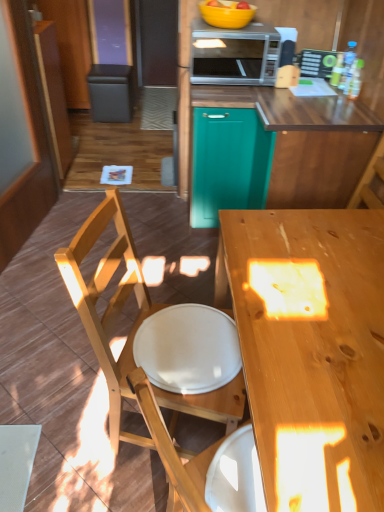
At what (x,y) coordinates should I click in order to perform the action: click on white matte plate at center. Please return your answer as a coordinate pair (x, y). Looking at the image, I should click on (188, 349).

What do you see at coordinates (316, 63) in the screenshot? The width and height of the screenshot is (384, 512). I see `green plastic sign at upper right` at bounding box center [316, 63].

What do you see at coordinates (305, 141) in the screenshot? Image resolution: width=384 pixels, height=512 pixels. I see `wooden countertop at center` at bounding box center [305, 141].

Measure the distance between point [197,90] and camera.

Point [197,90] and camera are 6.80 feet apart from each other.

Where is `wooden chair at left`? This screenshot has height=512, width=384. wooden chair at left is located at coordinates (109, 302).

What is the approximate width of wooden chair at left?

wooden chair at left is 51.39 centimeters in width.

Where is `white matte plate at center`? The height and width of the screenshot is (512, 384). white matte plate at center is located at coordinates (188, 349).

Considering the relative positions of yellow matte bowl at upper center and wooden chair at left in the image provided, is yellow matte bowl at upper center to the left of wooden chair at left from the viewer's perspective?

In fact, yellow matte bowl at upper center is to the right of wooden chair at left.

Based on the photo, can you see yellow matte bowl at upper center touching wooden chair at left?

No, yellow matte bowl at upper center is not in contact with wooden chair at left.

Is yellow matte bowl at upper center further to camera compared to wooden chair at left?

That is True.

How many degrees apart are the facing directions of green plastic sign at upper right and wooden desk at center?

The angular difference between green plastic sign at upper right and wooden desk at center is 67 degrees.

Between green plastic sign at upper right and wooden desk at center, which one has larger size?

wooden desk at center is bigger.

Can you confirm if green plastic sign at upper right is wider than wooden desk at center?

No.

Is green plastic sign at upper right directly adjacent to wooden desk at center?

No, green plastic sign at upper right is not in contact with wooden desk at center.

Image resolution: width=384 pixels, height=512 pixels. Find the location of `counter located behind the wooden desk at center`. counter located behind the wooden desk at center is located at coordinates (305, 141).

Would you say wooden countertop at center is part of wooden desk at center's contents?

No, wooden countertop at center is not surrounded by wooden desk at center.

Are wooden desk at center and wooden countertop at center beside each other?

No, wooden desk at center is not touching wooden countertop at center.

Does point (341, 285) come in front of point (334, 160)?

Yes, it is.

Which is more to the left, white matte plate at center or wooden countertop at center?

white matte plate at center is more to the left.

Which object is wider, white matte plate at center or wooden countertop at center?

Wider between the two is wooden countertop at center.

From the image's perspective, would you say white matte plate at center is shown under wooden countertop at center?

Yes, from the image's perspective, white matte plate at center is below wooden countertop at center.

What's the angular difference between silver metallic microwave at upper center and wooden desk at center's facing directions?

silver metallic microwave at upper center and wooden desk at center are facing 90.2 degrees away from each other.

Considering the relative sizes of silver metallic microwave at upper center and wooden desk at center in the image provided, is silver metallic microwave at upper center thinner than wooden desk at center?

Yes.

Looking at this image, who is shorter, silver metallic microwave at upper center or wooden desk at center?

silver metallic microwave at upper center.

From the image's perspective, who appears lower, silver metallic microwave at upper center or wooden desk at center?

From the image's view, wooden desk at center is below.

How different are the orientations of wooden chair at left and white matte plate at center in degrees?

6.89e-05 degrees.

Do you think wooden chair at left is within white matte plate at center, or outside of it?

wooden chair at left is not enclosed by white matte plate at center.

Based on their sizes in the image, would you say wooden chair at left is bigger or smaller than white matte plate at center?

Clearly, wooden chair at left is larger in size than white matte plate at center.

Is wooden chair at left next to white matte plate at center?

They are not placed beside each other.

This screenshot has height=512, width=384. Identify the location of trash bin/can above the white matte plate at center (from the image's perspective). (111, 92).

Is point (177, 383) farther from viewer compared to point (129, 96)?

No, it is not.

Looking at this image, are white matte plate at center and black leather trash bin/can at upper left making contact?

white matte plate at center and black leather trash bin/can at upper left are not in contact.

Where is `chair that is below the yellow matte bowl at upper center (from the image's perspective)`? chair that is below the yellow matte bowl at upper center (from the image's perspective) is located at coordinates (109, 302).

Locate an element on the screen. The height and width of the screenshot is (512, 384). appliance above the wooden desk at center (from the image's perspective) is located at coordinates (316, 63).

Considering their positions, is silver metallic microwave at upper center positioned closer to white matte plate at center than teal matte cabinet at center?

teal matte cabinet at center.

Considering their positions, is wooden countertop at center positioned further to black leather trash bin/can at upper left than wooden chair at left?

Among the two, wooden chair at left is located further to black leather trash bin/can at upper left.

Based on their spatial positions, is white matte plate at center or teal matte cabinet at center closer to black leather trash bin/can at upper left?

Based on the image, teal matte cabinet at center appears to be nearer to black leather trash bin/can at upper left.

Based on their spatial positions, is wooden desk at center or teal matte cabinet at center closer to white matte plate at center?

The object closer to white matte plate at center is wooden desk at center.

When comparing their distances from wooden chair at left, does wooden desk at center or wooden countertop at center seem further?

wooden countertop at center is positioned further to the anchor wooden chair at left.

In the scene shown: When comparing their distances from black leather trash bin/can at upper left, does teal matte cabinet at center or yellow matte bowl at upper center seem closer?

Among the two, yellow matte bowl at upper center is located nearer to black leather trash bin/can at upper left.

In the scene shown: Which object lies nearer to the anchor point teal matte cabinet at center, yellow matte bowl at upper center or white matte plate at center?

yellow matte bowl at upper center lies closer to teal matte cabinet at center than the other object.

Estimate the real-world distances between objects in this image. Which object is closer to wooden countertop at center, yellow matte bowl at upper center or black leather trash bin/can at upper left?

The object closer to wooden countertop at center is yellow matte bowl at upper center.

This screenshot has height=512, width=384. Find the location of `appliance between yellow matte bowl at upper center and wooden desk at center in the up-down direction`. appliance between yellow matte bowl at upper center and wooden desk at center in the up-down direction is located at coordinates (316, 63).

Where is `microwave oven that lies between yellow matte bowl at upper center and wooden chair at left from top to bottom`? The height and width of the screenshot is (512, 384). microwave oven that lies between yellow matte bowl at upper center and wooden chair at left from top to bottom is located at coordinates (234, 54).

This screenshot has width=384, height=512. I want to click on counter between silver metallic microwave at upper center and wooden desk at center in the vertical direction, so click(x=305, y=141).

Locate an element on the screen. chair between wooden desk at center and wooden countertop at center in the front-back direction is located at coordinates (109, 302).